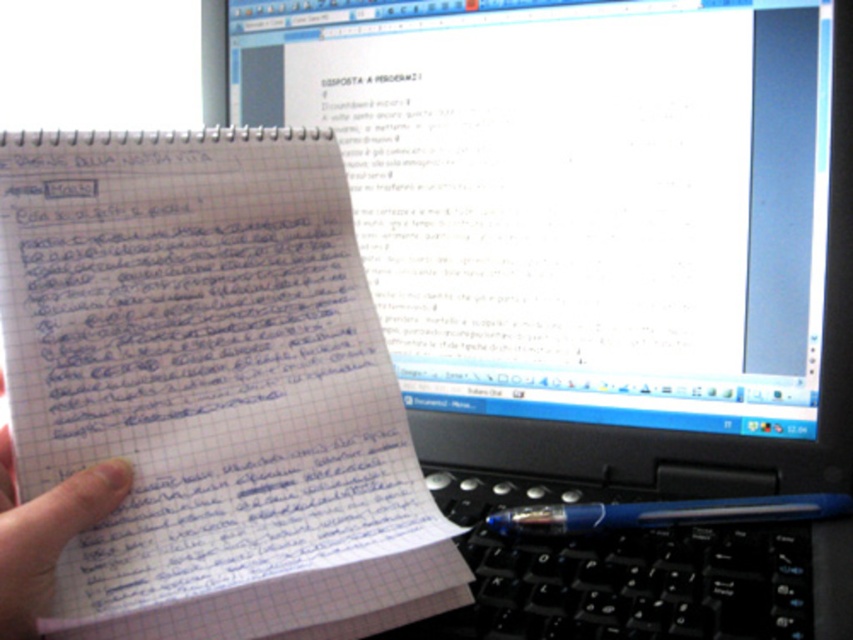
Who is more forward, (636,36) or (62,200)?

Point (62,200) is more forward.

Does point (357, 212) come closer to viewer compared to point (233, 381)?

No, (357, 212) is behind (233, 381).

Is point (734, 342) positioned before point (326, 618)?

No.

You are a GUI agent. You are given a task and a screenshot of the screen. Output one action in this format:
    pyautogui.click(x=<x>, y=<y>)
    Task: Click on the white glossy monitor at upper center
    This screenshot has height=640, width=853.
    Given the screenshot: What is the action you would take?
    pyautogui.click(x=573, y=195)

Does white glossy monitor at upper center have a smaller size compared to black plastic keyboard at lower center?

No.

Measure the distance between point (x=795, y=253) and camera.

Point (x=795, y=253) and camera are 22.25 inches apart.

The width and height of the screenshot is (853, 640). I want to click on white glossy monitor at upper center, so click(573, 195).

Is white lined paper at center further to camera compared to blue paper at center?

Yes, it is.

How much distance is there between white lined paper at center and blue paper at center?

white lined paper at center is 3.41 inches from blue paper at center.

Is point (364, 337) behind point (1, 456)?

That is True.

What are the coordinates of `white lined paper at center` in the screenshot? It's located at (212, 388).